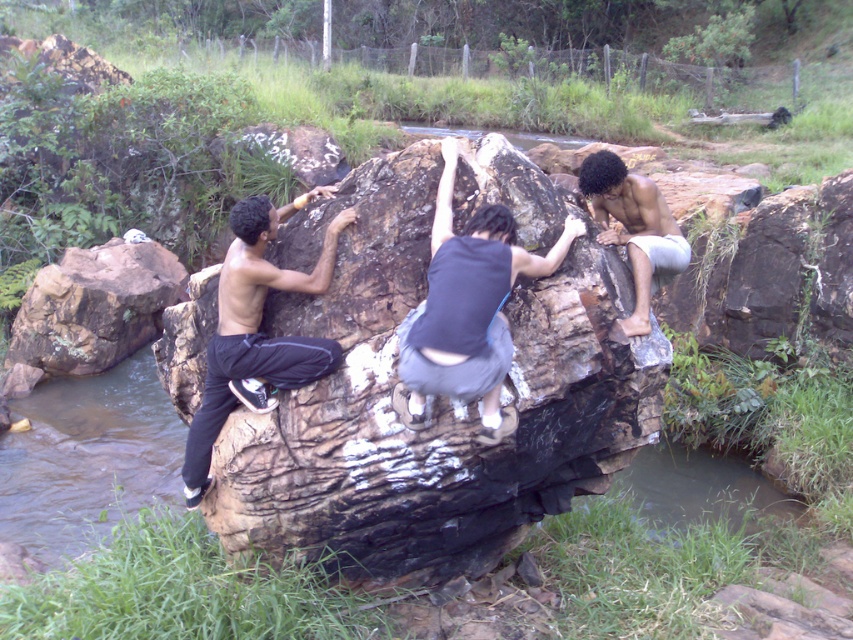
Question: Estimate the real-world distances between objects in this image. Which object is farther from the black matte pants at left?

Choices:
 (A) dark gray fabric pants at center
 (B) smooth gray shorts at right
 (C) brown rough rock at center

Answer: (B)

Question: Is brown rough rock at center above black matte pants at left?

Choices:
 (A) no
 (B) yes

Answer: (A)

Question: Does dark gray fabric pants at center have a greater width compared to black matte pants at left?

Choices:
 (A) yes
 (B) no

Answer: (A)

Question: Which point is farther from the camera taking this photo?

Choices:
 (A) (196, 433)
 (B) (363, 234)
 (C) (646, 288)

Answer: (C)

Question: Can you confirm if dark gray fabric pants at center is positioned to the right of smooth gray shorts at right?

Choices:
 (A) yes
 (B) no

Answer: (B)

Question: Which point is closer to the camera?

Choices:
 (A) (500, 300)
 (B) (213, 422)
 (C) (386, 506)
 (D) (643, 312)

Answer: (A)